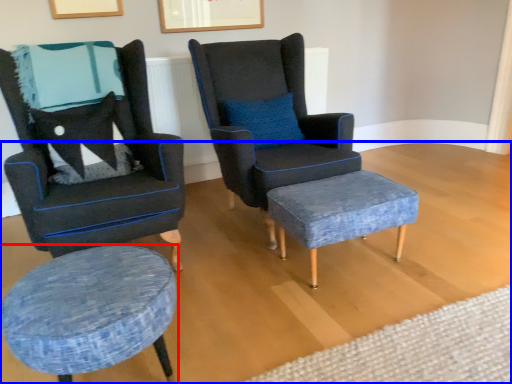
Question: Which object appears farthest to the camera in this image, stool (highlighted by a red box) or plain (highlighted by a blue box)?

Choices:
 (A) stool
 (B) plain

Answer: (A)